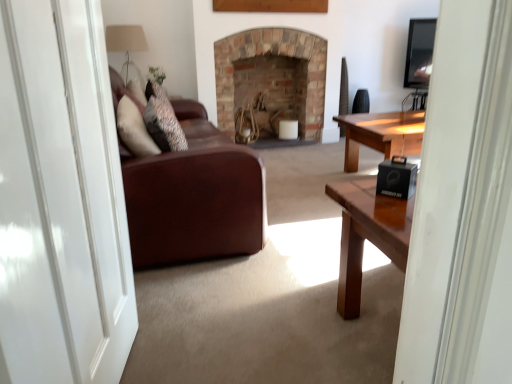
The width and height of the screenshot is (512, 384). Describe the element at coordinates (194, 197) in the screenshot. I see `leather couch at center` at that location.

What is the approximate height of black matte speaker at lower right?

It is 4.56 inches.

The width and height of the screenshot is (512, 384). Find the location of `translucent glass lampshade at upper left`. translucent glass lampshade at upper left is located at coordinates (125, 41).

Where is `brick fireplace at center`? This screenshot has height=384, width=512. brick fireplace at center is located at coordinates (271, 53).

Would you say leather couch at center is a long distance from black matte speaker at lower right?

leather couch at center is near black matte speaker at lower right, not far away.

Is leather couch at center positioned in front of black matte speaker at lower right?

No, it is behind black matte speaker at lower right.

What's the angular difference between leather couch at center and black matte speaker at lower right's facing directions?

38 degrees separate the facing orientations of leather couch at center and black matte speaker at lower right.

Is leather couch at center smaller than black matte speaker at lower right?

No.

Can you confirm if black matte speaker at lower right is taller than leather couch at center?

Incorrect, the height of black matte speaker at lower right is not larger of that of leather couch at center.

Would you say black matte speaker at lower right is to the left or to the right of leather couch at center in the picture?

black matte speaker at lower right is positioned on leather couch at center's right side.

Where is `speaker in front of the leather couch at center`? This screenshot has width=512, height=384. speaker in front of the leather couch at center is located at coordinates (396, 178).

Is leather couch at center located within black matte speaker at lower right?

No, leather couch at center is not a part of black matte speaker at lower right.

From a real-world perspective, which object stands above the other?

In real-world perspective, translucent glass lampshade at upper left is above.

Is leather couch at center located within translucent glass lampshade at upper left?

No, leather couch at center is not inside translucent glass lampshade at upper left.

How different are the orientations of translucent glass lampshade at upper left and leather couch at center in degrees?

They differ by 2.62 degrees in their facing directions.

Would you say translucent glass lampshade at upper left is a long distance from leather couch at center?

Yes, translucent glass lampshade at upper left and leather couch at center are located far from each other.

Consider the image. Is leather couch at center located outside white glossy door at left?

Yes.

Is point (184, 228) in front of point (98, 99)?

That is False.

Between leather couch at center and white glossy door at left, which one has more height?

white glossy door at left is taller.

From a real-world perspective, which is physically below, leather couch at center or white glossy door at left?

From a 3D spatial view, leather couch at center is below.

Is leather couch at center not inside brick fireplace at center?

Indeed, leather couch at center is completely outside brick fireplace at center.

In terms of width, does leather couch at center look wider or thinner when compared to brick fireplace at center?

Clearly, leather couch at center has more width compared to brick fireplace at center.

From the image's perspective, is leather couch at center on brick fireplace at center?

No.

Locate an element on the screen. The width and height of the screenshot is (512, 384). studio couch located in front of the brick fireplace at center is located at coordinates (194, 197).

Between black matte speaker at lower right and brick fireplace at center, which one has smaller size?

With smaller size is black matte speaker at lower right.

You are a GUI agent. You are given a task and a screenshot of the screen. Output one action in this format:
    pyautogui.click(x=<x>, y=<y>)
    Task: Click on the fireplace above the black matte speaker at lower right (from the image's perspective)
    
    Given the screenshot: What is the action you would take?
    pyautogui.click(x=271, y=53)

Is point (412, 183) farther from camera compared to point (316, 72)?

No, it is in front of (316, 72).

Is translucent glass lampshade at upper left situated inside brick fireplace at center or outside?

translucent glass lampshade at upper left is located beyond the bounds of brick fireplace at center.

Between translucent glass lampshade at upper left and brick fireplace at center, which one has larger size?

Bigger between the two is brick fireplace at center.

In terms of width, does translucent glass lampshade at upper left look wider or thinner when compared to brick fireplace at center?

Clearly, translucent glass lampshade at upper left has less width compared to brick fireplace at center.

Considering the positions of objects translucent glass lampshade at upper left and brick fireplace at center in the image provided, who is more to the right, translucent glass lampshade at upper left or brick fireplace at center?

Positioned to the right is brick fireplace at center.

This screenshot has width=512, height=384. In order to click on studio couch behind the black matte speaker at lower right in this screenshot , I will do `click(194, 197)`.

At what (x,y) coordinates should I click in order to perform the action: click on speaker that is above the leather couch at center (from a real-world perspective). Please return your answer as a coordinate pair (x, y). The image size is (512, 384). Looking at the image, I should click on (396, 178).

Estimate the real-world distances between objects in this image. Which object is closer to brick fireplace at center, leather couch at center or white glossy door at left?

The object closer to brick fireplace at center is leather couch at center.

Based on their spatial positions, is white glossy door at left or leather couch at center closer to black matte speaker at lower right?

Based on the image, leather couch at center appears to be nearer to black matte speaker at lower right.

Looking at the image, which one is located further to leather couch at center, black matte speaker at lower right or white glossy door at left?

black matte speaker at lower right is positioned further to the anchor leather couch at center.

Considering their positions, is leather couch at center positioned further to black matte speaker at lower right than white glossy door at left?

white glossy door at left.

Which object lies nearer to the anchor point brick fireplace at center, translucent glass lampshade at upper left or white glossy door at left?

translucent glass lampshade at upper left lies closer to brick fireplace at center than the other object.

Based on their spatial positions, is translucent glass lampshade at upper left or brick fireplace at center further from black matte speaker at lower right?

Based on the image, translucent glass lampshade at upper left appears to be further to black matte speaker at lower right.

Estimate the real-world distances between objects in this image. Which object is closer to black matte speaker at lower right, brick fireplace at center or translucent glass lampshade at upper left?

Based on the image, brick fireplace at center appears to be nearer to black matte speaker at lower right.

Which object lies nearer to the anchor point black matte speaker at lower right, leather couch at center or translucent glass lampshade at upper left?

leather couch at center is positioned closer to the anchor black matte speaker at lower right.

You are a GUI agent. You are given a task and a screenshot of the screen. Output one action in this format:
    pyautogui.click(x=<x>, y=<y>)
    Task: Click on the lamp between leather couch at center and brick fireplace at center from front to back
    
    Given the screenshot: What is the action you would take?
    pyautogui.click(x=125, y=41)

At what (x,y) coordinates should I click in order to perform the action: click on speaker positioned between white glossy door at left and brick fireplace at center from near to far. Please return your answer as a coordinate pair (x, y). This screenshot has height=384, width=512. Looking at the image, I should click on (396, 178).

This screenshot has width=512, height=384. Find the location of `lamp located between black matte speaker at lower right and brick fireplace at center in the depth direction`. lamp located between black matte speaker at lower right and brick fireplace at center in the depth direction is located at coordinates (125, 41).

The width and height of the screenshot is (512, 384). I want to click on studio couch between black matte speaker at lower right and translucent glass lampshade at upper left from front to back, so click(x=194, y=197).